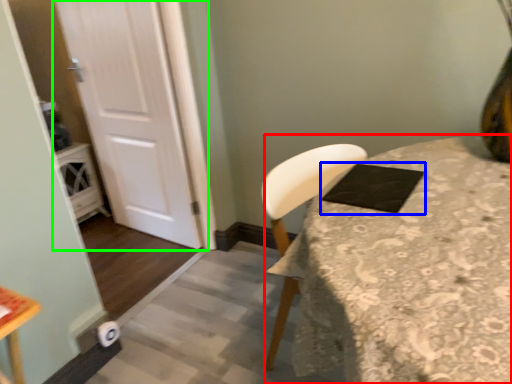
Question: Which is farther away from table (highlighted by a red box)? pad (highlighted by a blue box) or door (highlighted by a green box)?

Choices:
 (A) pad
 (B) door

Answer: (B)